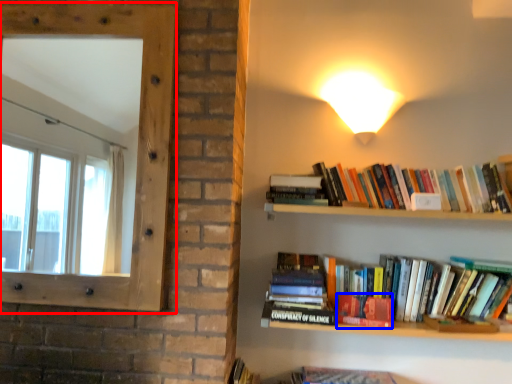
Question: Which object is closer to the camera taking this photo, window screen (highlighted by a red box) or paperback book (highlighted by a blue box)?

Choices:
 (A) window screen
 (B) paperback book

Answer: (A)